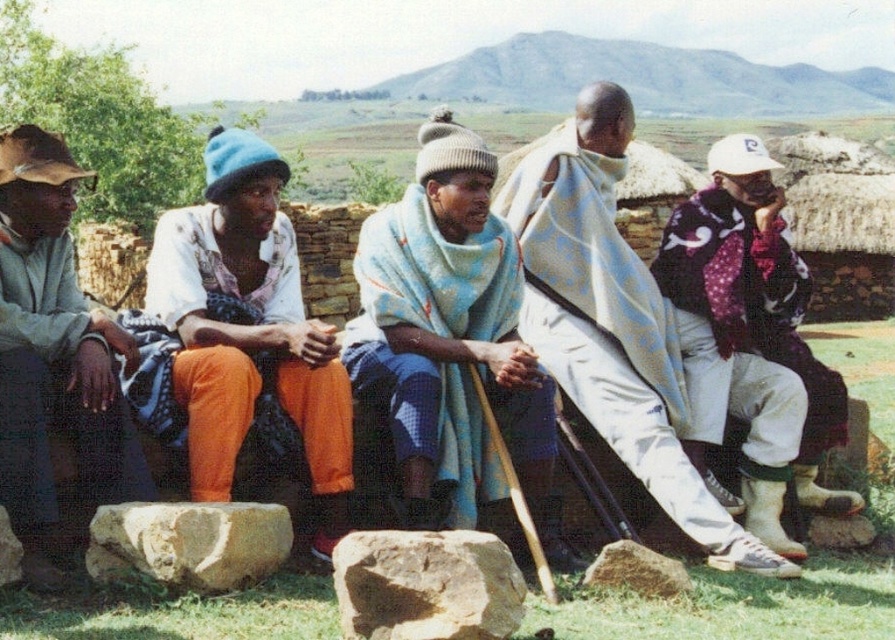
Question: Which of the following is the farthest from the observer?

Choices:
 (A) (105, 474)
 (B) (838, 525)

Answer: (B)

Question: Which object appears farthest from the camera in this image?

Choices:
 (A) white woven blanket at center
 (B) smooth beige rock at lower left
 (C) blue woolen blanket at center
 (D) smooth brown rock at center

Answer: (A)

Question: Which point is farther from the camera taking this photo?

Choices:
 (A) (262, 568)
 (B) (593, 314)
 (C) (832, 525)

Answer: (C)

Question: Can you confirm if white woven blanket at center is bigger than smooth gray rock at center?

Choices:
 (A) yes
 (B) no

Answer: (A)

Question: Does white woven blanket at center have a smaller size compared to orange fabric at left?

Choices:
 (A) yes
 (B) no

Answer: (B)

Question: Is white woven blanket at center above smooth brown rock at center?

Choices:
 (A) no
 (B) yes

Answer: (B)